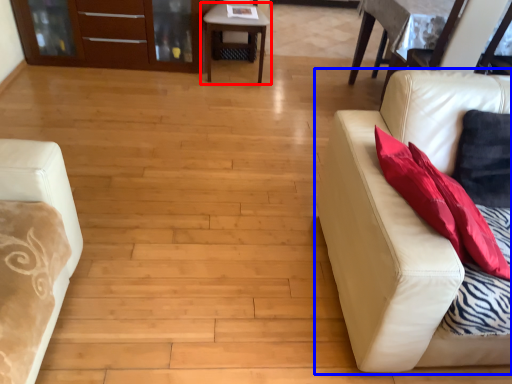
Question: Which object is further to the camera taking this photo, table (highlighted by a red box) or studio couch (highlighted by a blue box)?

Choices:
 (A) table
 (B) studio couch

Answer: (A)